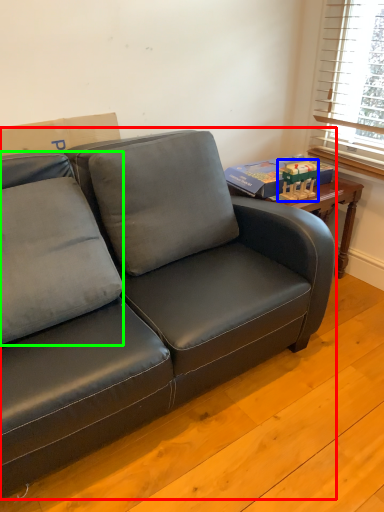
Question: Considering the real-world distances, which object is closest to studio couch (highlighted by a red box)? toy (highlighted by a blue box) or pillow (highlighted by a green box).

Choices:
 (A) toy
 (B) pillow

Answer: (B)